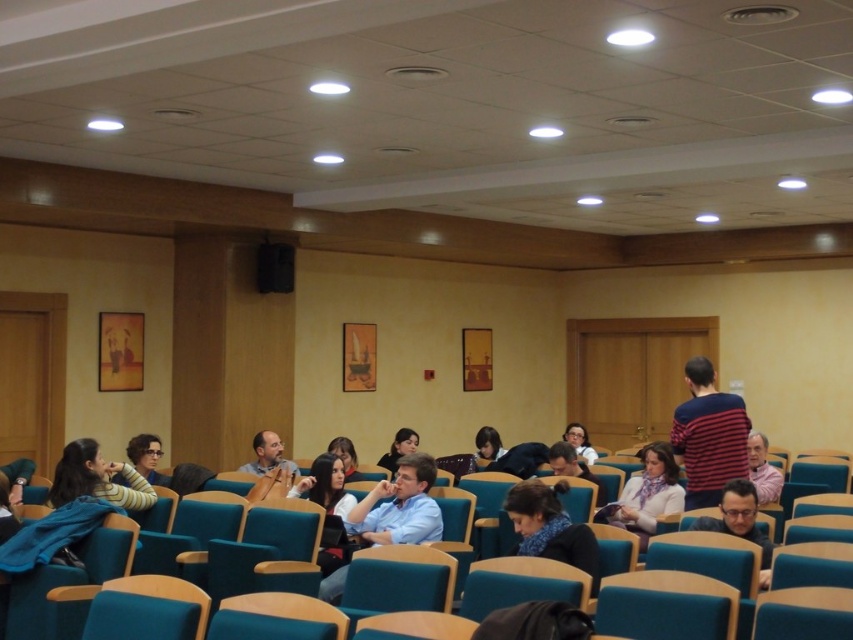
Is striped cotton shirt at center below striped sweater at lower left?

No, striped cotton shirt at center is not below striped sweater at lower left.

Does striped cotton shirt at center appear over striped sweater at lower left?

Yes.

Is point (699, 458) behind point (68, 468)?

Yes.

The height and width of the screenshot is (640, 853). What are the coordinates of `striped cotton shirt at center` in the screenshot? It's located at (708, 435).

Does point (244, 630) come closer to viewer compared to point (486, 442)?

That is True.

Where is `teal fabric chair at lower center`? teal fabric chair at lower center is located at coordinates (154, 620).

Based on the photo, can you confirm if striped cotton shirt at center is wider than matte black hair at center?

Indeed, striped cotton shirt at center has a greater width compared to matte black hair at center.

Is point (688, 388) farther from camera compared to point (498, 454)?

No, (688, 388) is in front of (498, 454).

You are a GUI agent. You are given a task and a screenshot of the screen. Output one action in this format:
    pyautogui.click(x=<x>, y=<y>)
    Task: Click on the striped cotton shirt at center
    
    Given the screenshot: What is the action you would take?
    pyautogui.click(x=708, y=435)